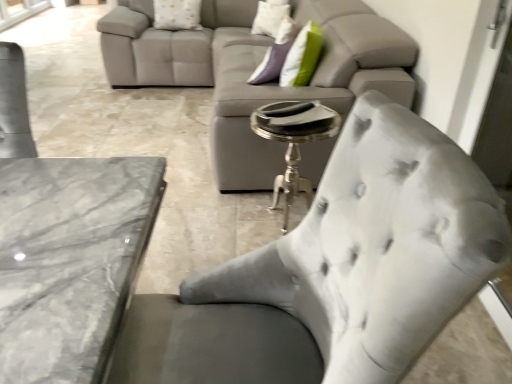
Image resolution: width=512 pixels, height=384 pixels. What are the coordinates of `vacant location below silver metallic side table at center (from a real-world perspective)` in the screenshot? It's located at (264, 223).